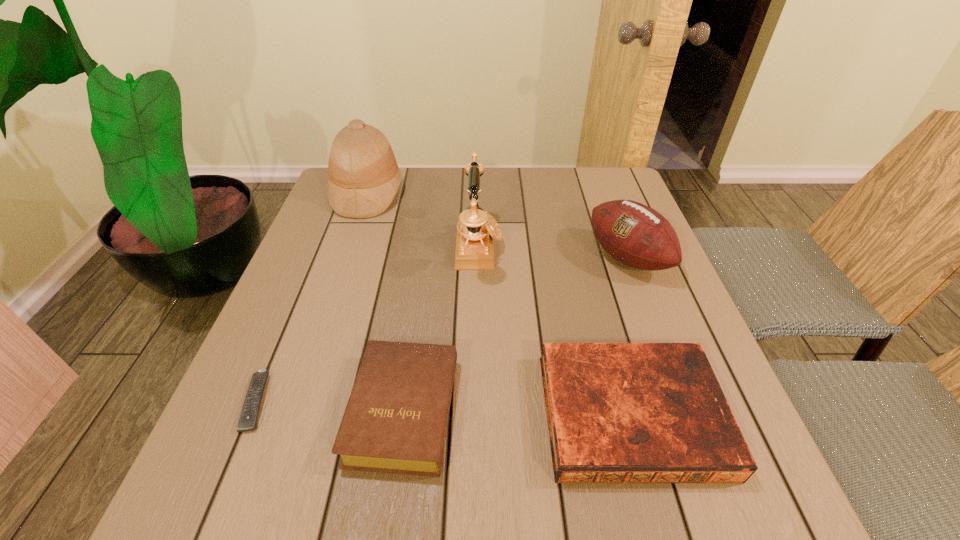
Identify the location of vacant space at the near edge. (554, 478).

Identify the location of free region at the left edge of the desktop. Image resolution: width=960 pixels, height=540 pixels. (x=334, y=270).

I want to click on vacant area at the right edge, so click(659, 309).

This screenshot has height=540, width=960. In the image, there is a desktop. In order to click on free space at the near left corner in this screenshot , I will do `click(259, 475)`.

Locate an element on the screen. free space at the far right corner of the desktop is located at coordinates (594, 188).

Locate an element on the screen. free space between the shortest object and the telephone is located at coordinates (368, 324).

The width and height of the screenshot is (960, 540). I want to click on vacant area between the third tallest object and the left Bible, so click(516, 334).

This screenshot has height=540, width=960. What are the coordinates of `free spot between the football (American) and the left Bible` in the screenshot? It's located at (516, 334).

Locate an element on the screen. The image size is (960, 540). free spot between the hat and the telephone is located at coordinates (423, 220).

Find the location of a particular element. Image resolution: width=960 pixels, height=540 pixels. free point between the right Bible and the hat is located at coordinates click(499, 303).